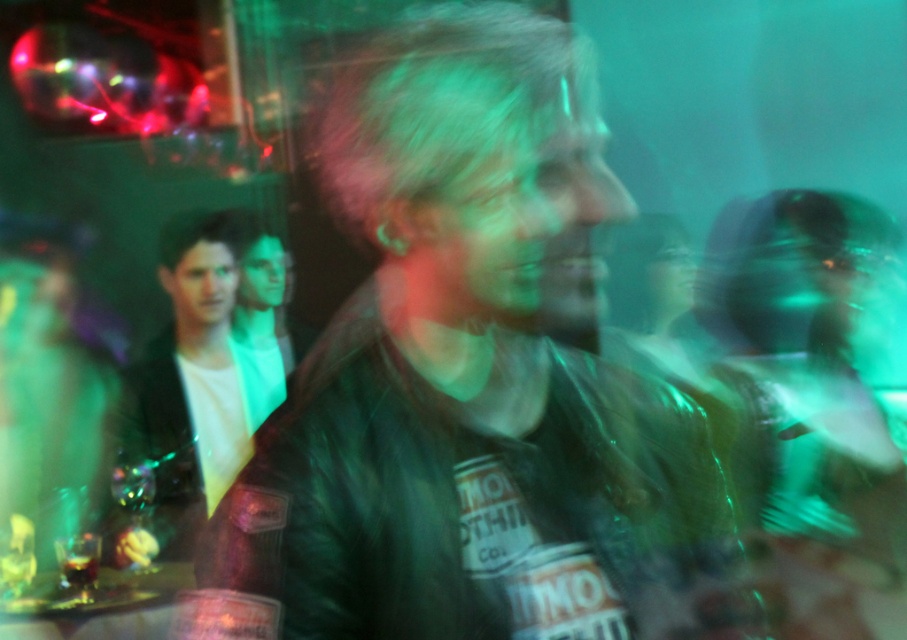
Who is shorter, leather jacket at center or white leather jacket at left?

leather jacket at center

Is point (527, 228) less distant than point (180, 342)?

Yes, it is in front of point (180, 342).

Identify the location of leather jacket at center. The height and width of the screenshot is (640, 907). (466, 369).